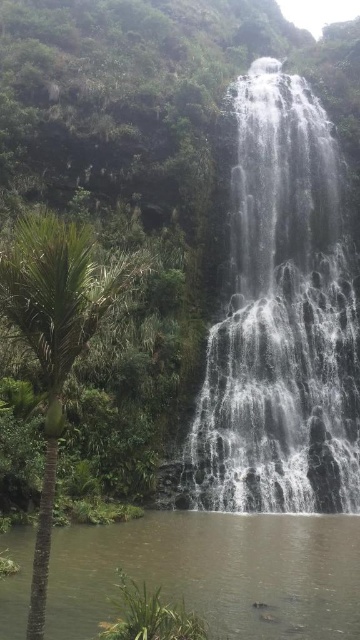
Question: Which object is farther from the camera taking this photo?

Choices:
 (A) translucent glass waterfall at center
 (B) green leafy palm tree at left

Answer: (A)

Question: Among these objects, which one is farthest from the camera?

Choices:
 (A) green leafy palm tree at left
 (B) brown smooth water at bottom
 (C) translucent glass waterfall at center

Answer: (C)

Question: Can you confirm if translucent glass waterfall at center is smaller than green leafy palm tree at left?

Choices:
 (A) no
 (B) yes

Answer: (A)

Question: Does translucent glass waterfall at center have a larger size compared to brown smooth water at bottom?

Choices:
 (A) no
 (B) yes

Answer: (B)

Question: Which object is farther from the camera taking this photo?

Choices:
 (A) green leafy palm tree at left
 (B) brown smooth water at bottom
 (C) translucent glass waterfall at center

Answer: (C)

Question: Is translucent glass waterfall at center wider than brown smooth water at bottom?

Choices:
 (A) yes
 (B) no

Answer: (B)